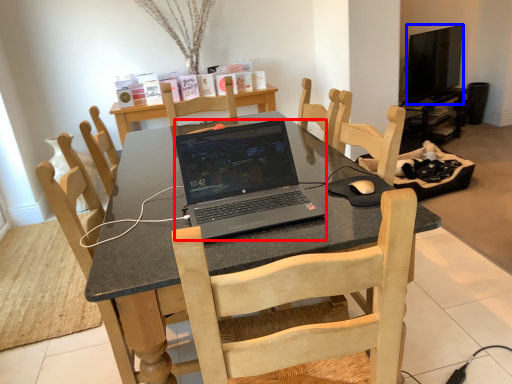
Question: Which object is further to the camera taking this photo, laptop (highlighted by a red box) or television (highlighted by a blue box)?

Choices:
 (A) laptop
 (B) television

Answer: (B)